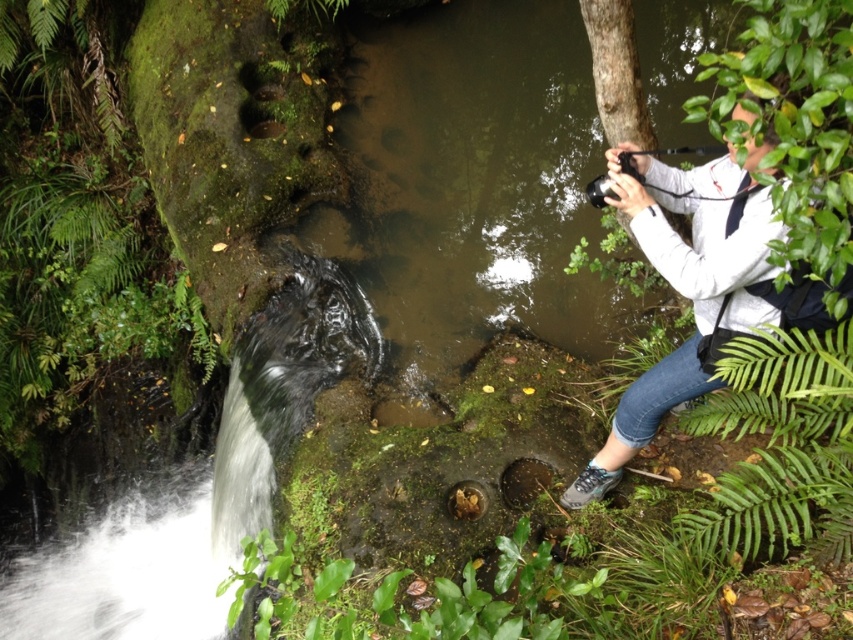
You are standing in the scene and want to take a photo of the waterfall. You notice the white fabric camera at upper right and the green leafy fern at lower right. Which object is closer to you?

The white fabric camera at upper right is closer to the viewer than the green leafy fern at lower right.

You are standing in the scene and want to take a photo of the waterfall. You see the white fabric camera at upper right and the green leafy fern at lower right. Which object is closer to the waterfall?

The white fabric camera at upper right is positioned on the left side of green leafy fern at lower right, so the white fabric camera at upper right is closer to the waterfall since it is to the left of the fern, which is on the right side of the frame.

You are a photographer trying to capture the waterfall in the scene. You notice the white fabric camera at upper right and the green leafy fern at lower right. Which object is bigger?

The white fabric camera at upper right is larger in size than the green leafy fern at lower right.